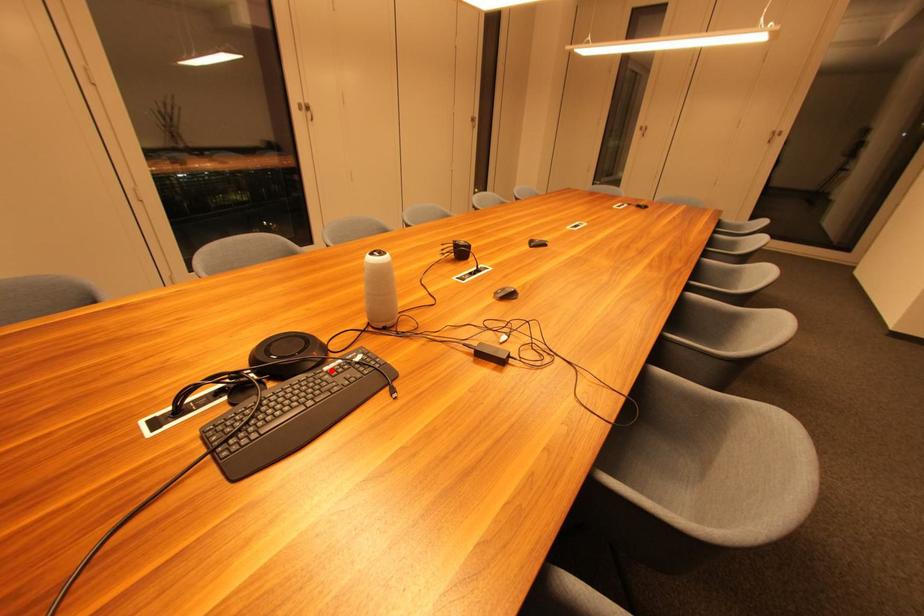
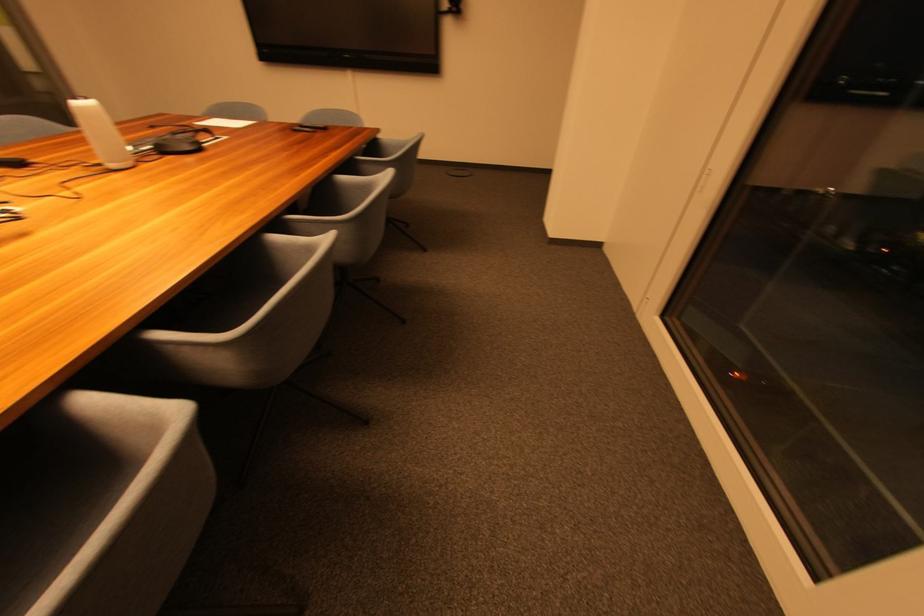
Question: I am providing you with two images of the same scene from different viewpoints. A red point is marked on the first image. At the location where the point appears in image 1, is it still visible in image 2?

Choices:
 (A) Yes
 (B) No

Answer: (B)